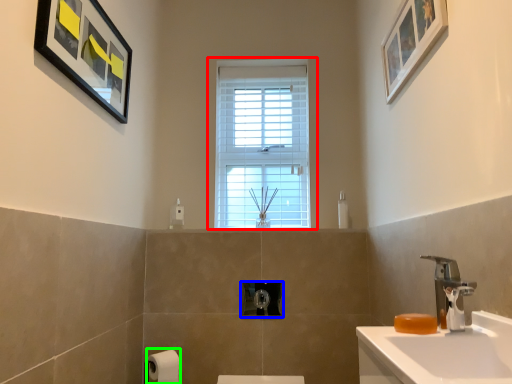
Question: Considering the real-world distances, which object is closest to window (highlighted by a red box)? towel bar (highlighted by a blue box) or toilet paper (highlighted by a green box).

Choices:
 (A) towel bar
 (B) toilet paper

Answer: (A)